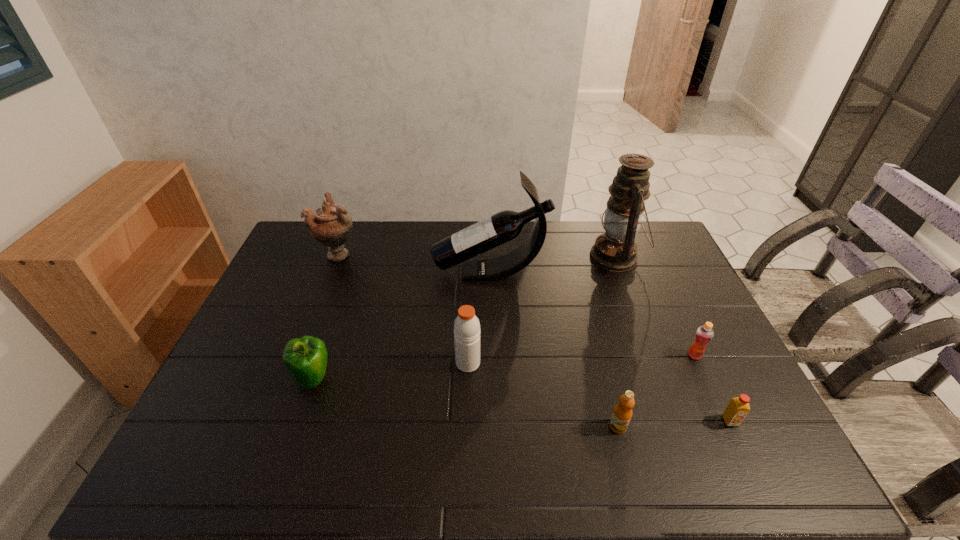
The image size is (960, 540). Identify the location of object that is the fifth closest to the fourth shortest object. (615, 250).

At what (x,y) coordinates should I click in order to perform the action: click on orange juice that can be found as the closest to the wine bottle. Please return your answer as a coordinate pair (x, y). The image size is (960, 540). Looking at the image, I should click on (704, 334).

Select which orange juice appears as the second closest to the farthest orange juice. Please provide its 2D coordinates. Your answer should be formatted as a tuple, i.e. [(x, y)], where the tuple contains the x and y coordinates of a point satisfying the conditions above.

[(622, 414)]